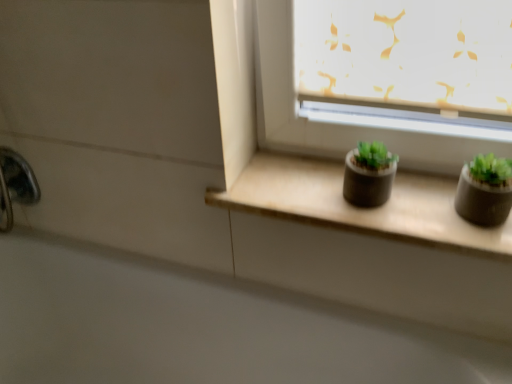
Question: Can we say matte concrete window sill at center lies outside polished chrome faucet at lower left?

Choices:
 (A) yes
 (B) no

Answer: (A)

Question: From the image's perspective, is matte concrete window sill at center on top of polished chrome faucet at lower left?

Choices:
 (A) yes
 (B) no

Answer: (B)

Question: Is matte concrete window sill at center at the left side of polished chrome faucet at lower left?

Choices:
 (A) no
 (B) yes

Answer: (A)

Question: Can you see matte concrete window sill at center touching polished chrome faucet at lower left?

Choices:
 (A) yes
 (B) no

Answer: (B)

Question: Considering the relative sizes of matte concrete window sill at center and polished chrome faucet at lower left in the image provided, is matte concrete window sill at center shorter than polished chrome faucet at lower left?

Choices:
 (A) yes
 (B) no

Answer: (A)

Question: Is white glossy bath at lower left taller or shorter than matte concrete window sill at center?

Choices:
 (A) short
 (B) tall

Answer: (B)

Question: Considering the positions of white glossy bath at lower left and matte concrete window sill at center in the image, is white glossy bath at lower left wider or thinner than matte concrete window sill at center?

Choices:
 (A) thin
 (B) wide

Answer: (B)

Question: Is point (345, 372) closer or farther from the camera than point (472, 233)?

Choices:
 (A) farther
 (B) closer

Answer: (A)

Question: In the image, is white glossy bath at lower left on the left side or the right side of matte concrete window sill at center?

Choices:
 (A) right
 (B) left

Answer: (B)

Question: Considering their positions, is polished chrome faucet at lower left located in front of or behind white glossy bath at lower left?

Choices:
 (A) front
 (B) behind

Answer: (B)

Question: Is polished chrome faucet at lower left situated inside white glossy bath at lower left or outside?

Choices:
 (A) inside
 (B) outside

Answer: (B)

Question: From a real-world perspective, relative to white glossy bath at lower left, is polished chrome faucet at lower left vertically above or below?

Choices:
 (A) below
 (B) above

Answer: (B)

Question: From the image's perspective, relative to white glossy bath at lower left, is polished chrome faucet at lower left above or below?

Choices:
 (A) above
 (B) below

Answer: (A)

Question: Relative to matte concrete window sill at center, is matte black pot at center, which is the second flowerpot from right to left, in front or behind?

Choices:
 (A) front
 (B) behind

Answer: (B)

Question: Is matte black pot at center, the 1th flowerpot viewed from the left, situated inside matte concrete window sill at center or outside?

Choices:
 (A) inside
 (B) outside

Answer: (B)